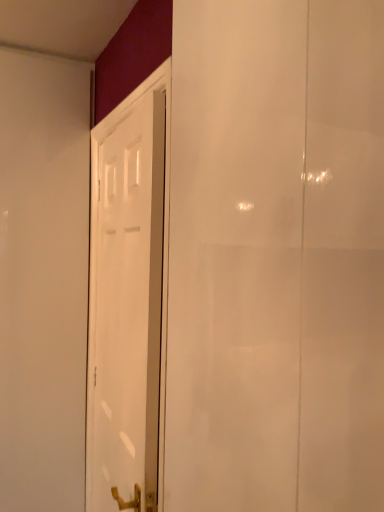
Question: In the image, is transparent glass screen door at center on the left side or the right side of white glossy door at center?

Choices:
 (A) right
 (B) left

Answer: (A)

Question: In terms of height, does transparent glass screen door at center look taller or shorter compared to white glossy door at center?

Choices:
 (A) tall
 (B) short

Answer: (B)

Question: Based on their sizes in the image, would you say transparent glass screen door at center is bigger or smaller than white glossy door at center?

Choices:
 (A) small
 (B) big

Answer: (B)

Question: Looking at the image, does white glossy door at center seem bigger or smaller compared to transparent glass screen door at center?

Choices:
 (A) small
 (B) big

Answer: (A)

Question: Does point (110, 237) appear closer or farther from the camera than point (203, 69)?

Choices:
 (A) closer
 (B) farther

Answer: (B)

Question: Is white glossy door at center to the left or to the right of transparent glass screen door at center in the image?

Choices:
 (A) left
 (B) right

Answer: (A)

Question: From their relative heights in the image, would you say white glossy door at center is taller or shorter than transparent glass screen door at center?

Choices:
 (A) short
 (B) tall

Answer: (B)